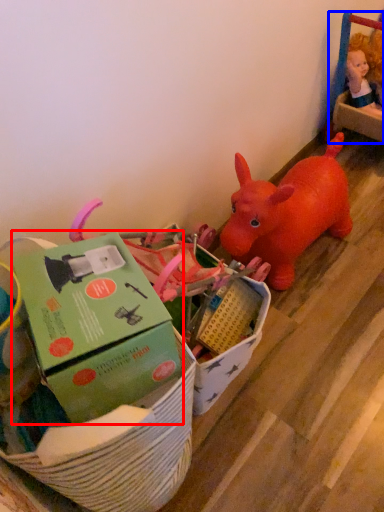
Question: Which of the following is the closest to the observer, box (highlighted by a red box) or toy (highlighted by a blue box)?

Choices:
 (A) box
 (B) toy

Answer: (A)